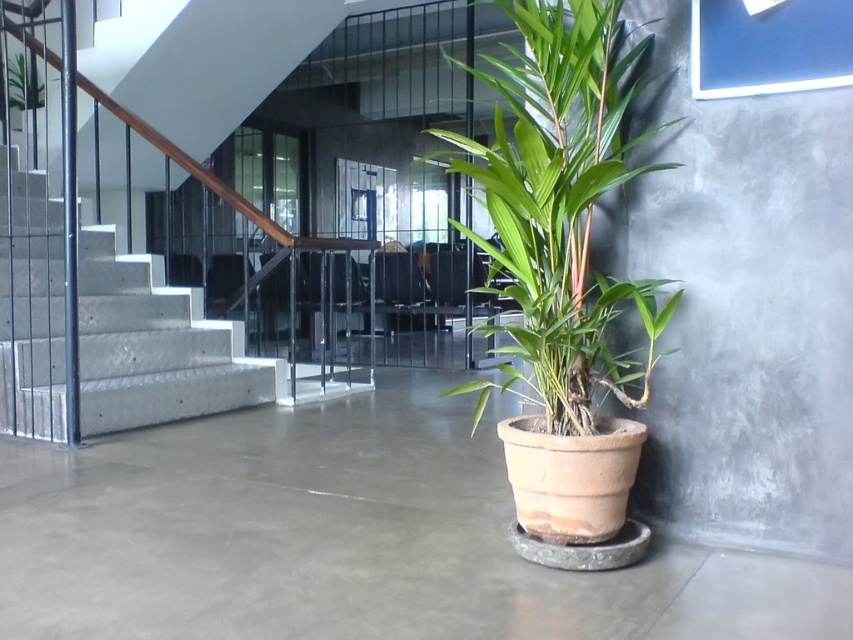
Is point (636, 378) farther from viewer compared to point (38, 76)?

No.

Is point (491, 58) less distant than point (16, 52)?

That is True.

At what (x,y) coordinates should I click in order to perform the action: click on green matte plant at center. Please return your answer as a coordinate pair (x, y). The image size is (853, 640). Looking at the image, I should click on (560, 209).

Does point (556, 340) come closer to viewer compared to point (10, 269)?

That is True.

Which is more to the right, green matte plant at center or concrete/stamped concrete stairs at left?

Positioned to the right is green matte plant at center.

Find the location of a particular element. Image resolution: width=853 pixels, height=640 pixels. green matte plant at center is located at coordinates (560, 209).

Between smooth concrete floor at center and concrete/stamped concrete stairs at left, which one is positioned higher?

concrete/stamped concrete stairs at left is higher up.

Which is more to the right, smooth concrete floor at center or concrete/stamped concrete stairs at left?

smooth concrete floor at center is more to the right.

Is point (712, 630) positioned after point (106, 296)?

No, (712, 630) is closer to viewer.

Where is `smooth concrete floor at center`? smooth concrete floor at center is located at coordinates [x=346, y=540].